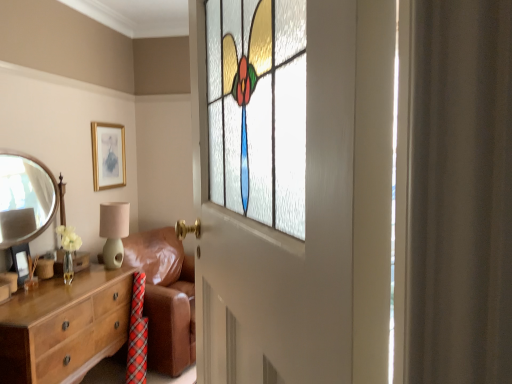
Question: Could gold metallic picture frame at upper center, marked as the first picture frame in a top-to-bottom arrangement, be considered to be inside silver metallic mirror at left?

Choices:
 (A) yes
 (B) no

Answer: (B)

Question: From a real-world perspective, is silver metallic mirror at left over gold metallic picture frame at upper center, the 2th picture frame when ordered from left to right?

Choices:
 (A) no
 (B) yes

Answer: (A)

Question: Does silver metallic mirror at left have a greater width compared to gold metallic picture frame at upper center, the 2th picture frame positioned from the bottom?

Choices:
 (A) yes
 (B) no

Answer: (A)

Question: Is silver metallic mirror at left not close to gold metallic picture frame at upper center, which appears as the first picture frame when viewed from the right?

Choices:
 (A) no
 (B) yes

Answer: (A)

Question: Is silver metallic mirror at left located outside gold metallic picture frame at upper center, marked as the first picture frame in a top-to-bottom arrangement?

Choices:
 (A) no
 (B) yes

Answer: (B)

Question: Is silver metallic mirror at left looking in the opposite direction of gold metallic picture frame at upper center, which appears as the first picture frame when viewed from the back?

Choices:
 (A) no
 (B) yes

Answer: (A)

Question: Is stained glass window at center completely or partially inside matte gold picture frame at lower left, which is the 2th picture frame from top to bottom?

Choices:
 (A) yes
 (B) no

Answer: (B)

Question: Does matte gold picture frame at lower left, positioned as the second picture frame in right-to-left order, come behind stained glass window at center?

Choices:
 (A) yes
 (B) no

Answer: (A)

Question: Is matte gold picture frame at lower left, positioned as the second picture frame in right-to-left order, next to stained glass window at center and touching it?

Choices:
 (A) no
 (B) yes

Answer: (A)

Question: Is matte gold picture frame at lower left, the 1th picture frame in the left-to-right sequence, aimed at stained glass window at center?

Choices:
 (A) no
 (B) yes

Answer: (A)

Question: From the image's perspective, is matte gold picture frame at lower left, placed as the second picture frame when sorted from back to front, located above stained glass window at center?

Choices:
 (A) yes
 (B) no

Answer: (B)

Question: Is matte gold picture frame at lower left, positioned as the second picture frame in right-to-left order, facing away from stained glass window at center?

Choices:
 (A) yes
 (B) no

Answer: (B)

Question: From the image's perspective, is brown leather couch at center beneath gold metallic picture frame at upper center, the 2th picture frame positioned from the bottom?

Choices:
 (A) yes
 (B) no

Answer: (A)